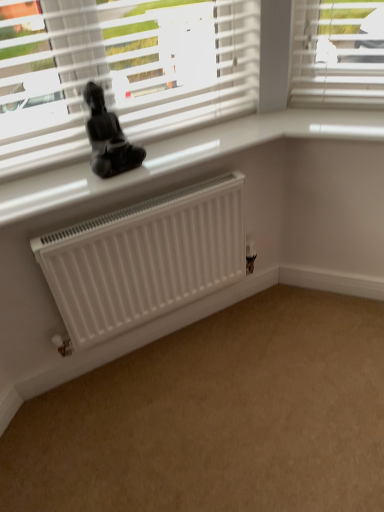
Where is `vacant position to the left of black glossy statue at upper center`? This screenshot has height=512, width=384. vacant position to the left of black glossy statue at upper center is located at coordinates (56, 177).